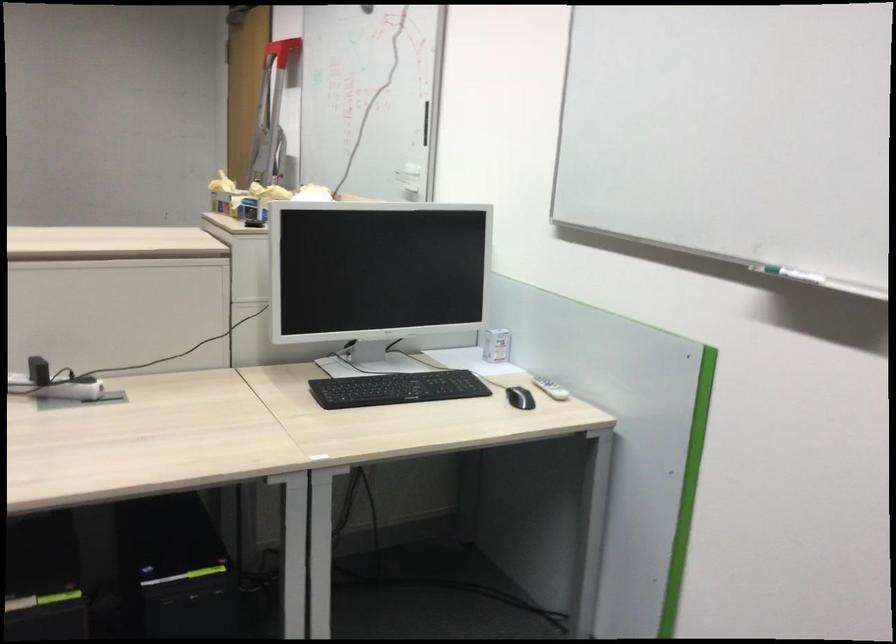
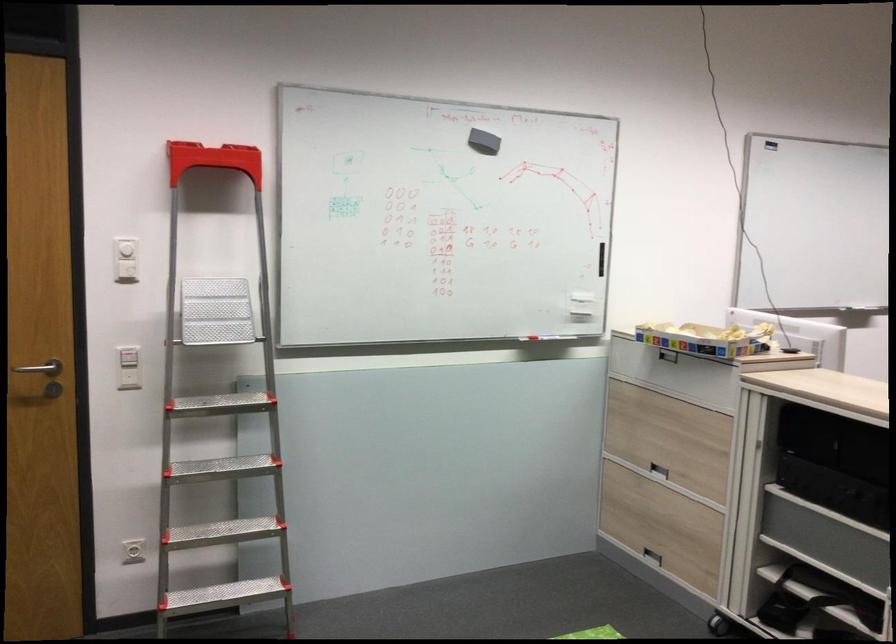
Where in the second image is the point corresponding to [233,192] from the first image?

(705, 339)